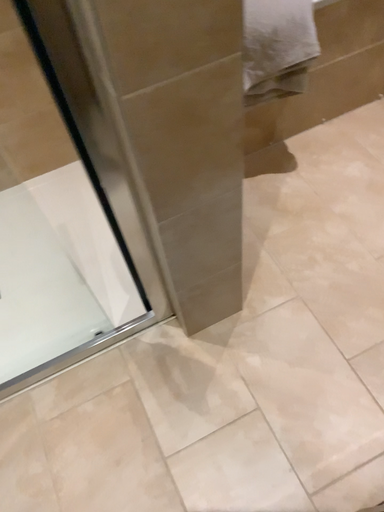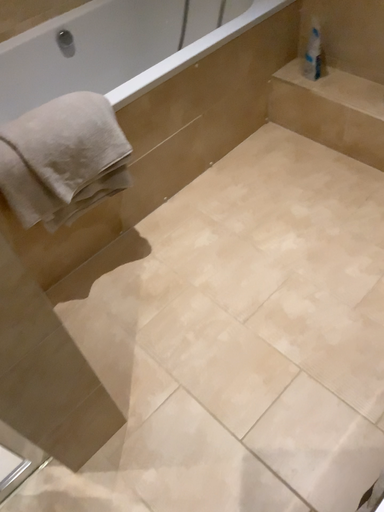
Question: Which way did the camera rotate in the video?

Choices:
 (A) rotated left
 (B) rotated right

Answer: (B)